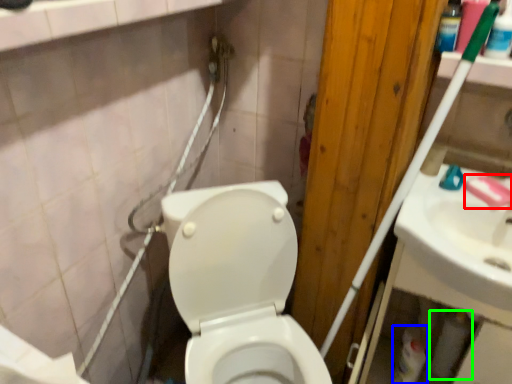
Question: Which is nearer to the soap (highlighted by a red box)? cleaning product (highlighted by a blue box) or toilet paper (highlighted by a green box).

Choices:
 (A) cleaning product
 (B) toilet paper

Answer: (B)